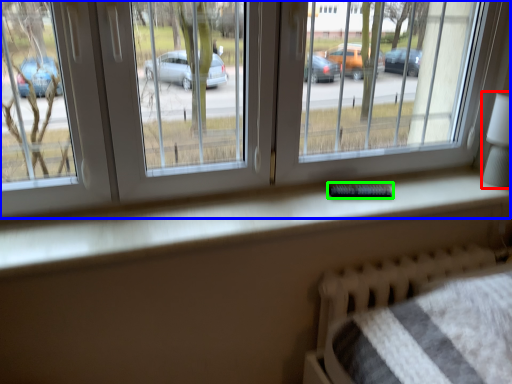
Question: Which object is the farthest from table lamp (highlighted by a red box)? Choose among these: window (highlighted by a blue box) or remote (highlighted by a green box).

Choices:
 (A) window
 (B) remote

Answer: (B)